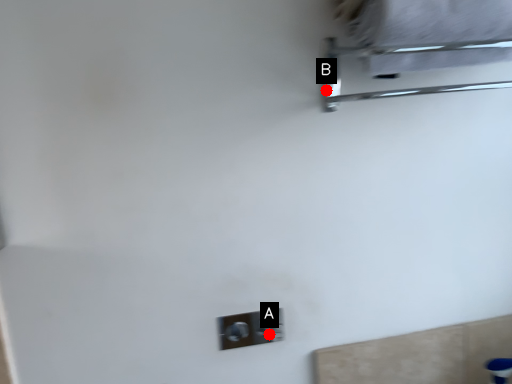
Question: Two points are circled on the image, labeled by A and B beside each circle. Which point is closer to the camera?

Choices:
 (A) A is closer
 (B) B is closer

Answer: (B)